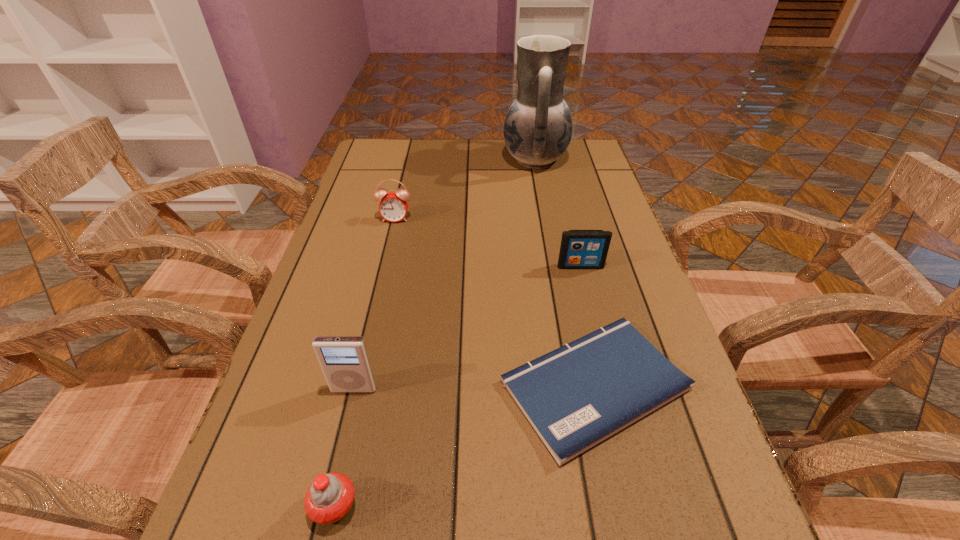
The image size is (960, 540). I want to click on cupcake positioned at the left edge, so click(x=328, y=500).

Image resolution: width=960 pixels, height=540 pixels. What are the coordinates of `pitcher that is positioned at the right edge` in the screenshot? It's located at (538, 126).

Locate an element on the screen. The width and height of the screenshot is (960, 540). iPod that is at the right edge is located at coordinates (580, 249).

The image size is (960, 540). I want to click on paperback book that is at the right edge, so click(x=576, y=396).

Where is `object located in the far right corner section of the desktop`? object located in the far right corner section of the desktop is located at coordinates (538, 126).

Where is `free space at the far edge`? This screenshot has width=960, height=540. free space at the far edge is located at coordinates (485, 156).

Find the location of `vacant region at the left edge`. vacant region at the left edge is located at coordinates (298, 445).

Locate an element on the screen. The image size is (960, 540). free space at the right edge of the desktop is located at coordinates (622, 296).

Where is `vacant space at the far left corner`? Image resolution: width=960 pixels, height=540 pixels. vacant space at the far left corner is located at coordinates (372, 150).

Find the location of a particular element. This screenshot has height=540, width=960. vacant space at the far right corner of the desktop is located at coordinates (596, 151).